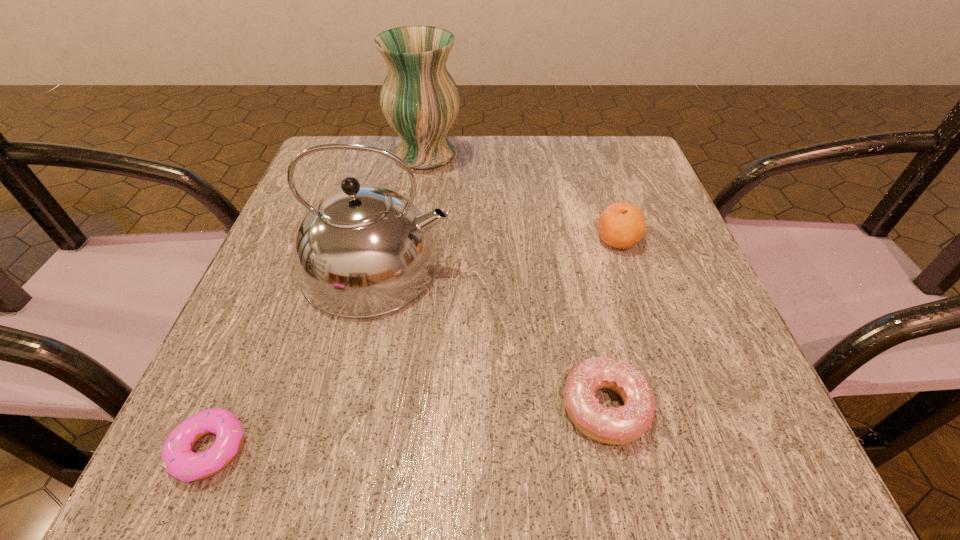
Locate an element on the screen. The width and height of the screenshot is (960, 540). free space located on the back of the right doughnut is located at coordinates (564, 210).

At what (x,y) coordinates should I click in order to perform the action: click on vacant space located on the right of the left doughnut. Please return your answer as a coordinate pair (x, y). Looking at the image, I should click on (383, 449).

The height and width of the screenshot is (540, 960). I want to click on object that is at the far edge, so click(420, 100).

Where is `kettle present at the left edge`? kettle present at the left edge is located at coordinates (361, 251).

Locate an element on the screen. The width and height of the screenshot is (960, 540). doughnut that is at the left edge is located at coordinates (179, 460).

I want to click on clementine present at the right edge, so tap(621, 225).

At what (x,y) coordinates should I click in order to perform the action: click on doughnut present at the right edge. Please return your answer as a coordinate pair (x, y). The image size is (960, 540). Looking at the image, I should click on [x=621, y=425].

The height and width of the screenshot is (540, 960). Identify the location of object that is at the near left corner. (179, 460).

Find the location of `object located in the near right corner section of the desktop`. object located in the near right corner section of the desktop is located at coordinates (621, 425).

In the image, there is a desktop. Where is `free space at the far edge`? free space at the far edge is located at coordinates (472, 187).